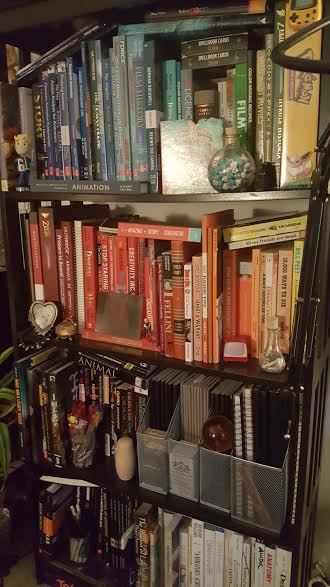
Locate an element on the screen. This screenshot has width=330, height=587. wall is located at coordinates (323, 534).